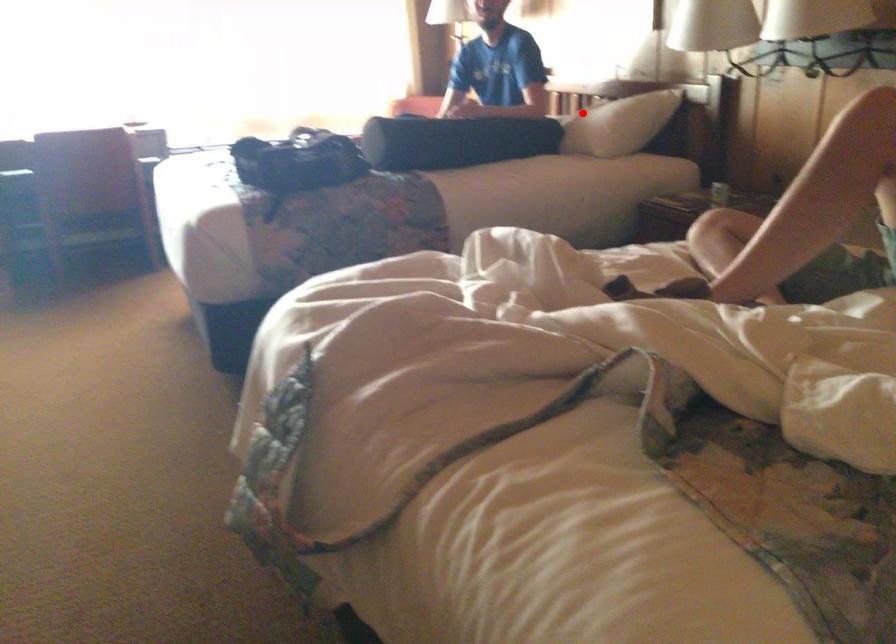
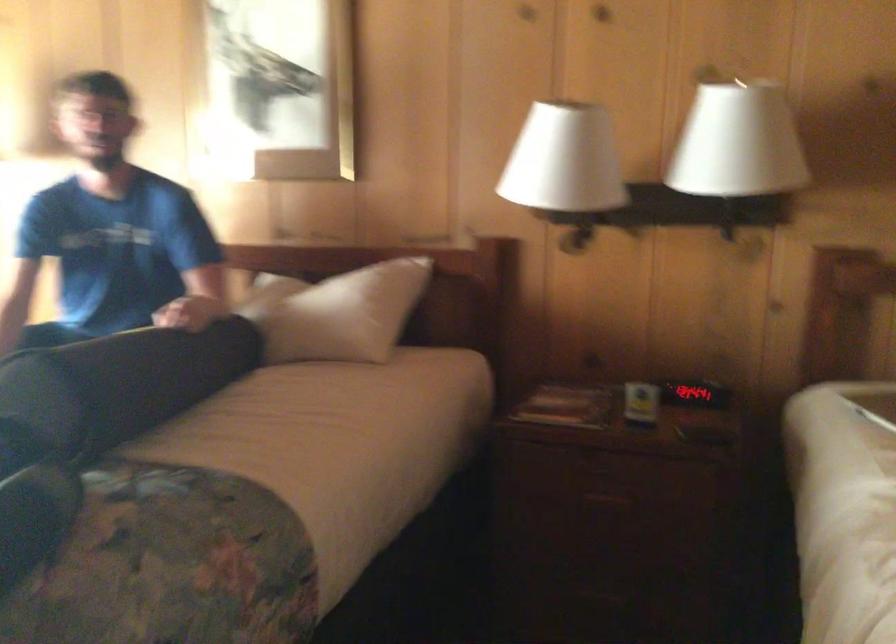
The point at the highlighted location is marked in the first image. Where is the corresponding point in the second image?

(340, 313)